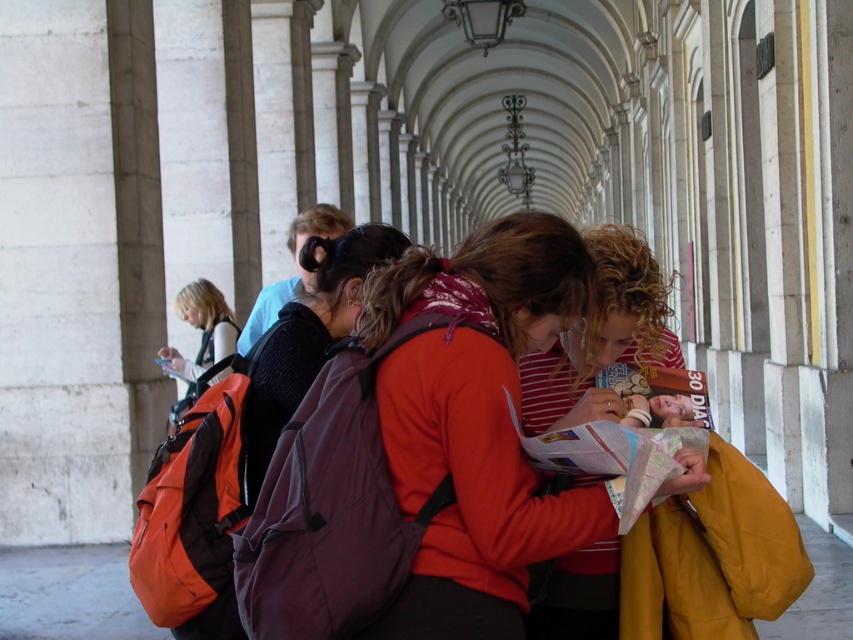
You are organizing a group activity and need to determine storage capacity. Given the orange backpack at center and the red striped shirt at center, which item can hold more items based on their sizes?

The orange backpack at center has a larger size compared to the red striped shirt at center, so it can hold more items.

You are standing at the entrance of the arches and want to locate the dark gray backpack at center. According to the coordinates provided, in which direction should you move to find it?

The dark gray backpack at center is located at coordinates point (306, 336). Since the coordinate system is not specified, it is recommended to move towards the central area of the scene to locate it.